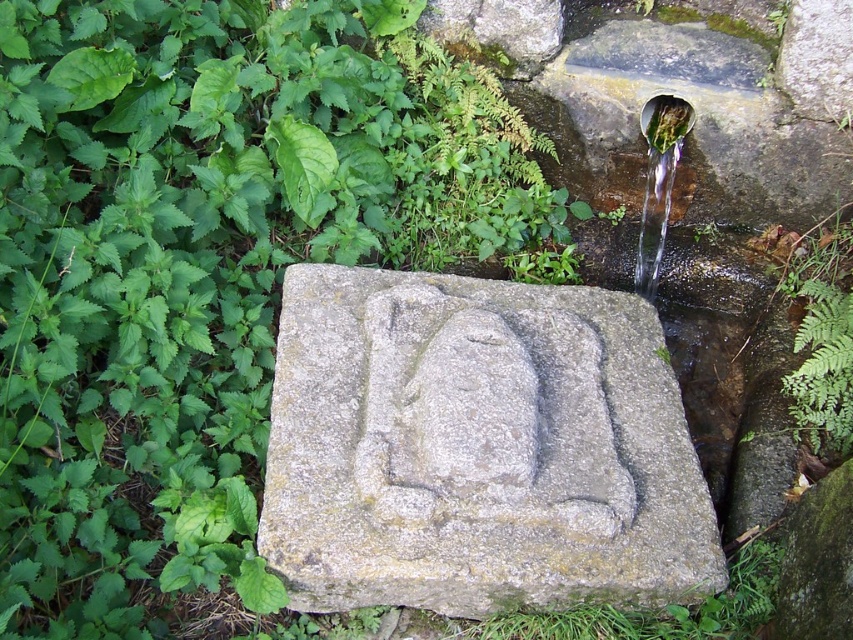
Does gray stone carving at center come behind green metallic pipe at upper right?

No, gray stone carving at center is in front of green metallic pipe at upper right.

Can you confirm if gray stone carving at center is thinner than green metallic pipe at upper right?

No, gray stone carving at center is not thinner than green metallic pipe at upper right.

Where is `gray stone carving at center`? gray stone carving at center is located at coordinates (479, 451).

Based on the photo, between green leafy plant at lower right and green metallic pipe at upper right, which one is positioned higher?

green metallic pipe at upper right is above.

Can you confirm if green leafy plant at lower right is shorter than green metallic pipe at upper right?

Correct, green leafy plant at lower right is not as tall as green metallic pipe at upper right.

Who is more forward, (824,403) or (634,278)?

Point (824,403) is in front.

Identify the location of green leafy plant at lower right. The width and height of the screenshot is (853, 640). [x=822, y=369].

Is point (447, 326) positioned before point (828, 346)?

Yes, point (447, 326) is in front of point (828, 346).

Who is more distant from viewer, (364,273) or (849,328)?

Point (364,273)

You are a GUI agent. You are given a task and a screenshot of the screen. Output one action in this format:
    pyautogui.click(x=<x>, y=<y>)
    Task: Click on the gray stone carving at center
    Image resolution: width=853 pixels, height=640 pixels.
    Given the screenshot: What is the action you would take?
    pyautogui.click(x=479, y=451)